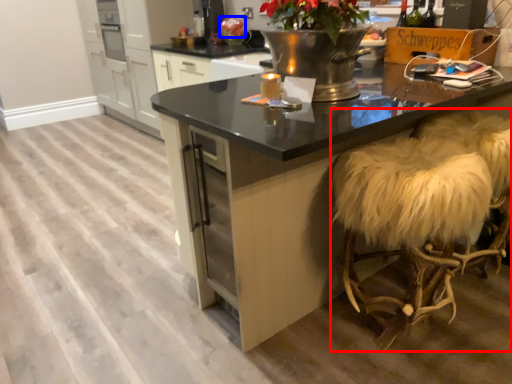
Question: Among these objects, which one is farthest to the camera, swivel chair (highlighted by a red box) or flower (highlighted by a blue box)?

Choices:
 (A) swivel chair
 (B) flower

Answer: (B)